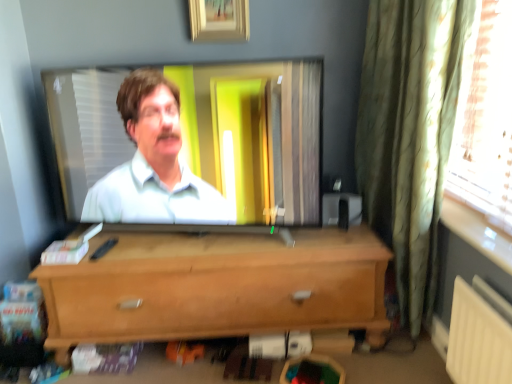
In the image, there is a wooden picture frame at upper center. From a real-world perspective, locate several points in the blank space situated above wooden picture frame at upper center. Your answer should be formatted as a list of tuples, i.e. [(x1, y1)], where each tuple contains the x and y coordinates of a point satisfying the conditions above.

[(0.415, -0.000)]